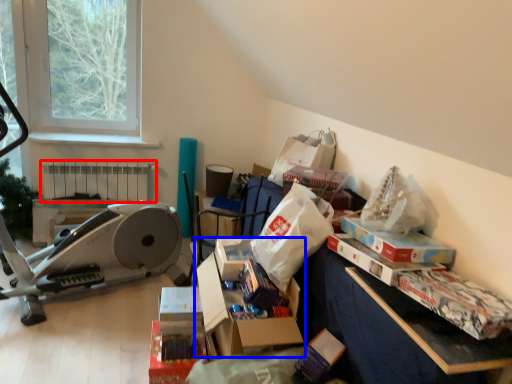
Question: Among these objects, which one is farthest to the camera, radiator (highlighted by a red box) or storage box (highlighted by a blue box)?

Choices:
 (A) radiator
 (B) storage box

Answer: (A)